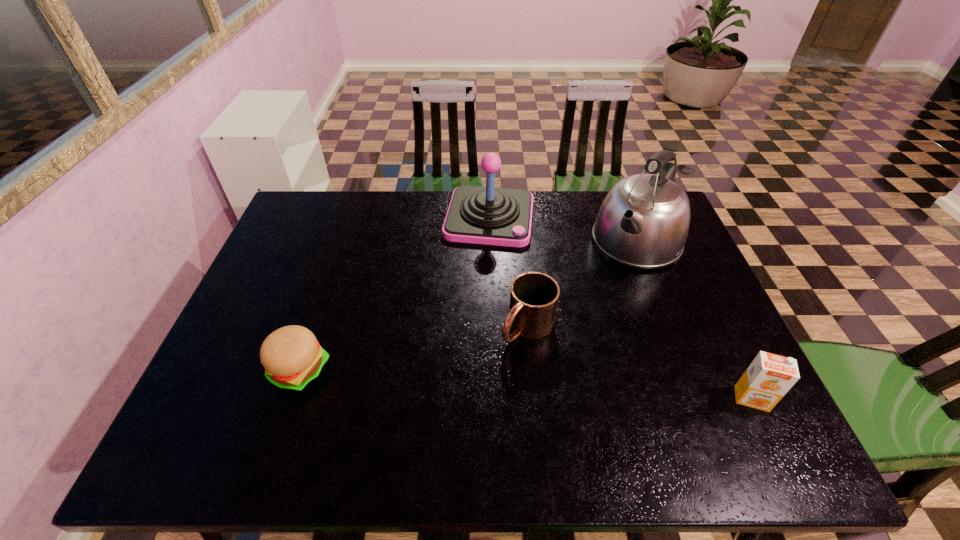
What are the coordinates of `object located in the left edge section of the desktop` in the screenshot? It's located at (292, 357).

At what (x,y) coordinates should I click in order to perform the action: click on orange juice that is at the right edge. Please return your answer as a coordinate pair (x, y). Image resolution: width=960 pixels, height=540 pixels. Looking at the image, I should click on (769, 377).

At what (x,y) coordinates should I click in order to perform the action: click on kettle located at the right edge. Please return your answer as a coordinate pair (x, y). This screenshot has height=540, width=960. Looking at the image, I should click on (643, 222).

Locate an element on the screen. object at the near left corner is located at coordinates (292, 357).

I want to click on object present at the far right corner, so click(643, 222).

This screenshot has height=540, width=960. What are the coordinates of `object situated at the near right corner` in the screenshot? It's located at (769, 377).

In the image, there is a desktop. Identify the location of vacant space at the far edge. (435, 207).

Find the location of `vacant space at the near edge of the desktop`. vacant space at the near edge of the desktop is located at coordinates (370, 383).

Where is `vacant position at the left edge of the desktop`? The image size is (960, 540). vacant position at the left edge of the desktop is located at coordinates (277, 260).

The width and height of the screenshot is (960, 540). What are the coordinates of `vacant space at the right edge of the desktop` in the screenshot? It's located at [x=719, y=311].